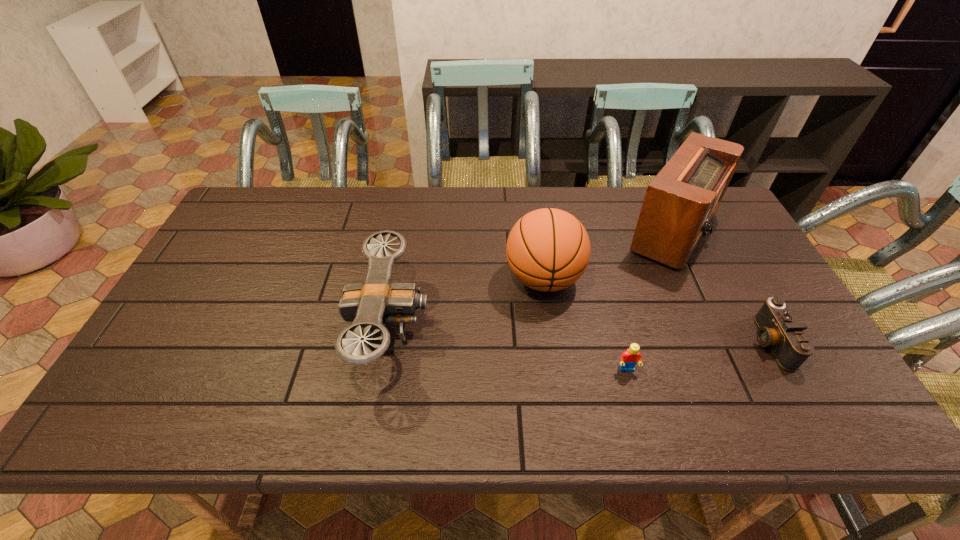
The width and height of the screenshot is (960, 540). I want to click on vacant space that's between the camera and the third shortest object, so click(x=580, y=334).

Where is `the fourth closest object to the basketball`? Image resolution: width=960 pixels, height=540 pixels. the fourth closest object to the basketball is located at coordinates (778, 329).

Select which object is the closest to the fourth object from right to left. Please provide its 2D coordinates. Your answer should be formatted as a tuple, i.e. [(x, y)], where the tuple contains the x and y coordinates of a point satisfying the conditions above.

[(680, 202)]

Find the location of a particular element. The image size is (960, 540). vacant point that satisfies the following two spatial constraints: 1. on the front side of the radio receiver; 2. on the front-facing side of the third tallest object is located at coordinates (716, 326).